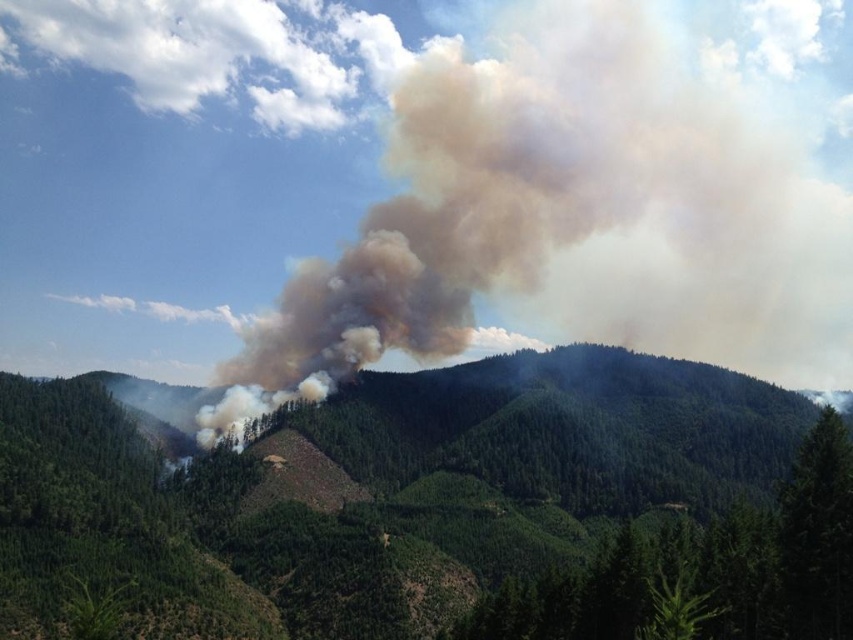
You are a firefighter assessing the wildfire scene. You notice the green forested mountain at center and the brown smoke at center. Which of these two landmarks is located to the left when viewed from your position?

The green forested mountain at center is positioned on the left side of the brown smoke at center, so it is located to the left when viewed from your position.